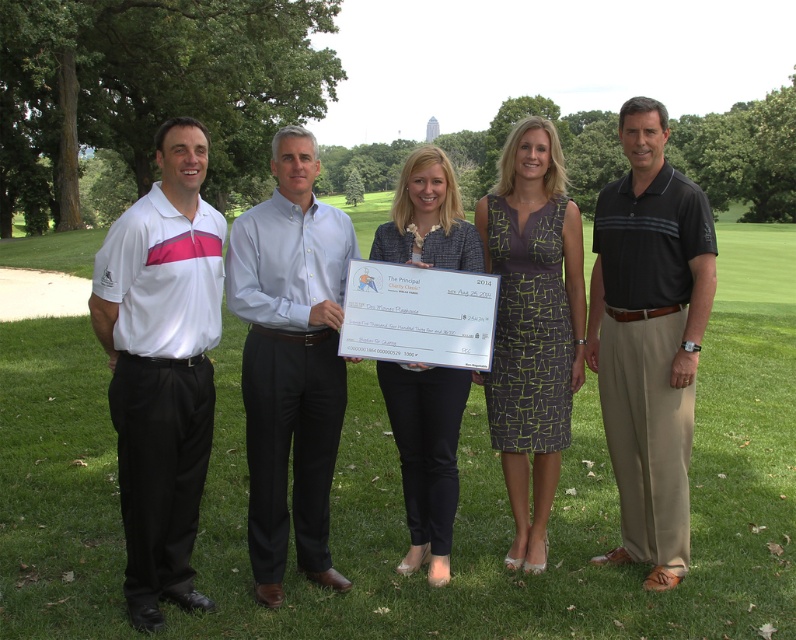
Question: Does green grass at center lie in front of light blue shirt at center?

Choices:
 (A) no
 (B) yes

Answer: (A)

Question: Which point is closer to the camera?

Choices:
 (A) [533, 394]
 (B) [301, 228]
 (C) [537, 620]
 (D) [112, 404]

Answer: (D)

Question: Does white smooth polo shirt at left come in front of printed fabric dress at center?

Choices:
 (A) yes
 (B) no

Answer: (A)

Question: Which object appears closest to the camera in this image?

Choices:
 (A) printed fabric dress at center
 (B) light blue shirt at center
 (C) patterned fabric dress at center

Answer: (B)

Question: Is white smooth polo shirt at left below patterned fabric dress at center?

Choices:
 (A) no
 (B) yes

Answer: (A)

Question: Which object is farther from the camera taking this photo?

Choices:
 (A) light blue shirt at center
 (B) dark brown striped polo shirt at center
 (C) white smooth polo shirt at left
 (D) printed fabric dress at center

Answer: (D)